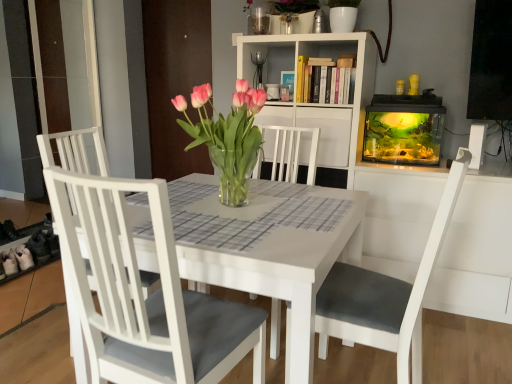
Question: Considering the relative sizes of white wood shelf at upper center and transparent glass aquarium at right in the image provided, is white wood shelf at upper center wider than transparent glass aquarium at right?

Choices:
 (A) yes
 (B) no

Answer: (A)

Question: Is white wood shelf at upper center surrounding transparent glass aquarium at right?

Choices:
 (A) no
 (B) yes

Answer: (A)

Question: From a real-world perspective, is white wood shelf at upper center over transparent glass aquarium at right?

Choices:
 (A) yes
 (B) no

Answer: (B)

Question: Does white wood shelf at upper center appear on the right side of transparent glass aquarium at right?

Choices:
 (A) no
 (B) yes

Answer: (A)

Question: Does white wood shelf at upper center have a larger size compared to transparent glass aquarium at right?

Choices:
 (A) no
 (B) yes

Answer: (B)

Question: Can you confirm if white wood shelf at upper center is smaller than transparent glass aquarium at right?

Choices:
 (A) no
 (B) yes

Answer: (A)

Question: From a real-world perspective, is pink glass vase at center on white wood shelf at upper center?

Choices:
 (A) yes
 (B) no

Answer: (A)

Question: Is pink glass vase at center oriented away from white wood shelf at upper center?

Choices:
 (A) yes
 (B) no

Answer: (A)

Question: From the image's perspective, would you say pink glass vase at center is shown under white wood shelf at upper center?

Choices:
 (A) yes
 (B) no

Answer: (A)

Question: Is pink glass vase at center closer to the viewer compared to white wood shelf at upper center?

Choices:
 (A) yes
 (B) no

Answer: (A)

Question: Is pink glass vase at center outside white wood shelf at upper center?

Choices:
 (A) no
 (B) yes

Answer: (B)

Question: Does pink glass vase at center come behind white wood shelf at upper center?

Choices:
 (A) no
 (B) yes

Answer: (A)

Question: Is pink glass vase at center positioned with its back to white matte chair at left, placed as the 1th chair when sorted from left to right?

Choices:
 (A) yes
 (B) no

Answer: (B)